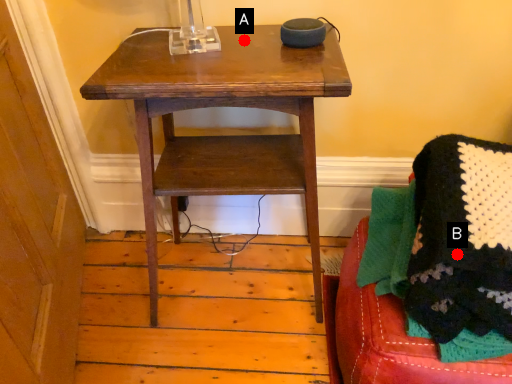
Question: Two points are circled on the image, labeled by A and B beside each circle. Which point appears closest to the camera in this image?

Choices:
 (A) A is closer
 (B) B is closer

Answer: (B)